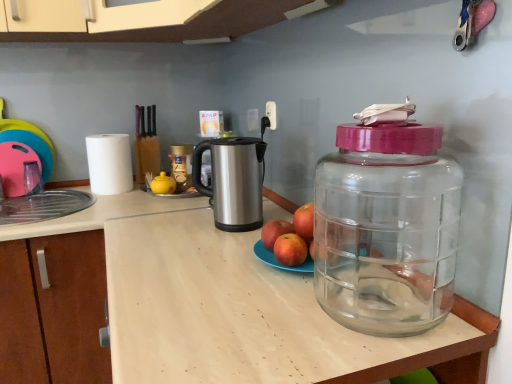
Find the location of a particular element. The image size is (512, 384). vacant space situated on the left part of silver metallic kettle at center is located at coordinates (177, 226).